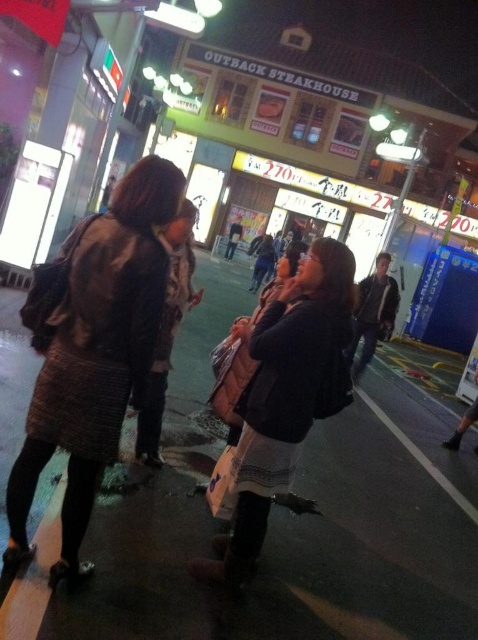
Question: Which point is farther to the camera?

Choices:
 (A) (237, 532)
 (B) (376, 595)

Answer: (B)

Question: Can you confirm if knitted wool coat at center is positioned above dark brown leather jacket at center?

Choices:
 (A) no
 (B) yes

Answer: (B)

Question: Can you confirm if dark asphalt pavement at center is thinner than knitted wool coat at center?

Choices:
 (A) no
 (B) yes

Answer: (B)

Question: Where is dark asphalt pavement at center located in relation to knitted wool coat at center in the image?

Choices:
 (A) left
 (B) right

Answer: (A)

Question: Which point is farther to the camera?

Choices:
 (A) dark asphalt pavement at center
 (B) knitted wool coat at center

Answer: (B)

Question: Which of the following is the closest to the observer?

Choices:
 (A) [286, 360]
 (B) [195, 438]
 (C) [150, 282]

Answer: (C)